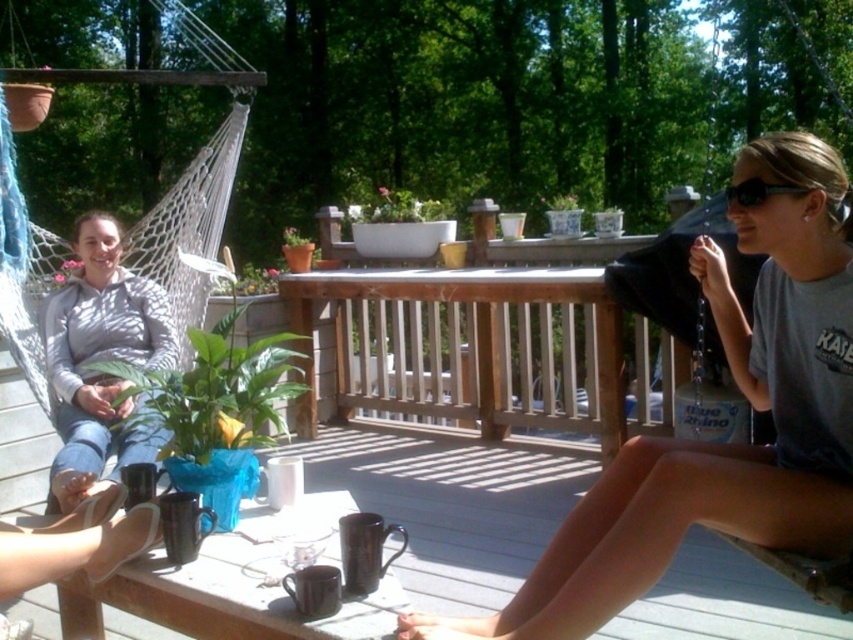
In the scene shown: You are organizing a picnic basket and need to know which item can hold more items between the matte black bag at right and the black plastic sunglasses at upper right. Which one can hold more?

The matte black bag at right is bigger than the black plastic sunglasses at upper right, so it can hold more items.

You are a delivery person who needs to place a small package between the matte black bag at right and the light gray hoodie at left. Since the package is 10 cm tall, will it fit vertically between them?

The matte black bag at right is taller than the light gray hoodie at left. Since the package is 10 cm tall, it can fit vertically between them as long as the space between the two objects is at least 10 cm in height.

You are standing at the point marked as point (782, 392). You want to throw a ball to someone standing 1.73 meters away from you. Is the person on the left wearing a light gray hoodie and blue jeans within that distance?

The person on the left wearing a light gray hoodie and blue jeans is seated at the hanging white hammock swing. The distance between point (782, 392) and the viewer is 1.73 meters, so yes, the person is within that distance.